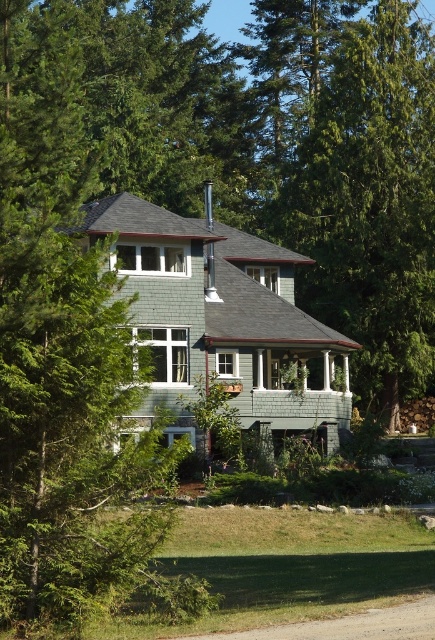
Question: Can you confirm if green leafy tree at left is wider than green textured tree at center?

Choices:
 (A) no
 (B) yes

Answer: (B)

Question: Which object is farther from the camera taking this photo?

Choices:
 (A) green leafy tree at left
 (B) green textured tree at center

Answer: (B)

Question: Where is green leafy tree at left located in relation to green textured tree at center in the image?

Choices:
 (A) above
 (B) below

Answer: (B)

Question: Which point is closer to the camera?

Choices:
 (A) (16, 112)
 (B) (414, 173)

Answer: (A)

Question: Does green leafy tree at left appear on the left side of green textured tree at center?

Choices:
 (A) no
 (B) yes

Answer: (B)

Question: Which point is closer to the camera?

Choices:
 (A) green leafy tree at left
 (B) green textured tree at center

Answer: (A)